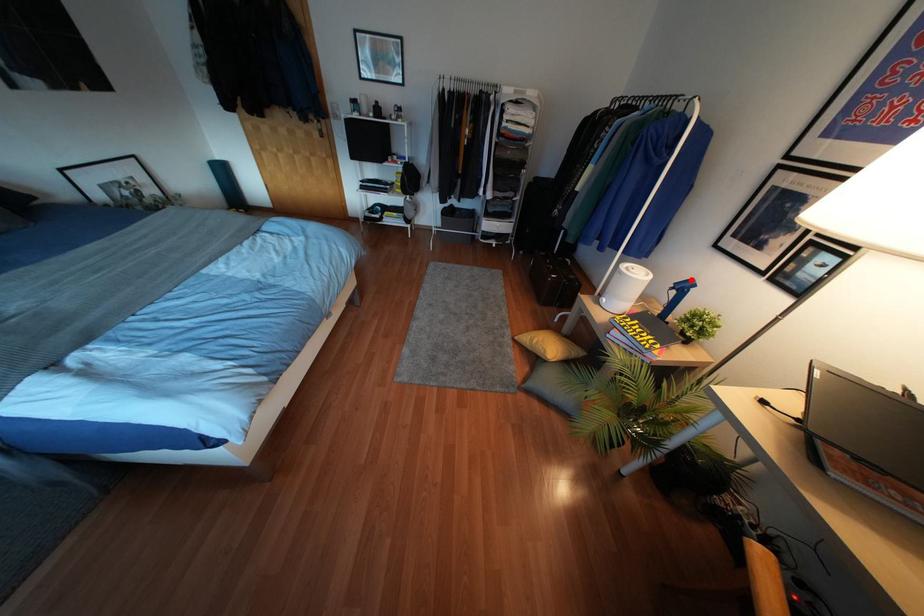
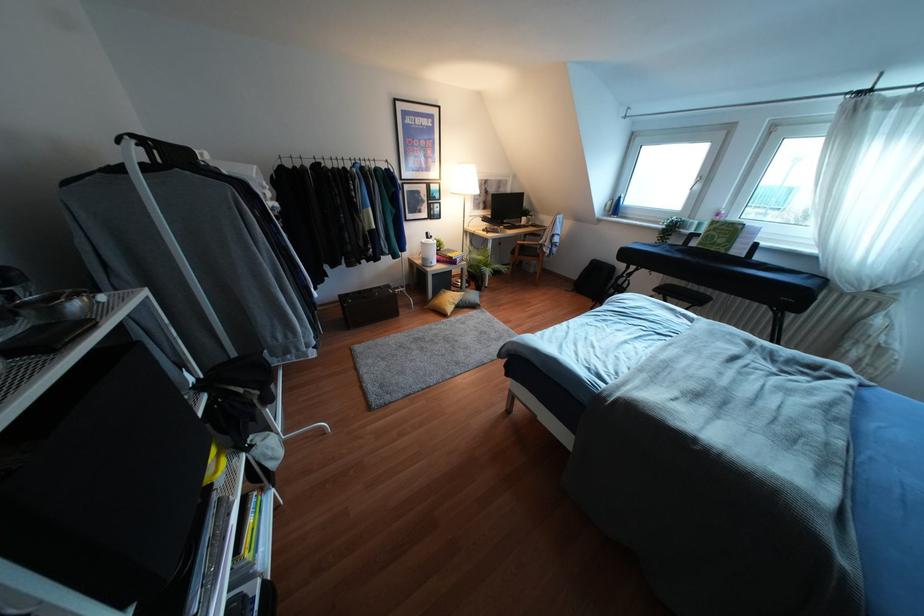
Question: I am providing you with two images of the same scene from different viewpoints. Given a red point in image1, look at the same physical point in image2. Is it:

Choices:
 (A) Closer to the viewpoint
 (B) Farther from the viewpoint

Answer: (A)